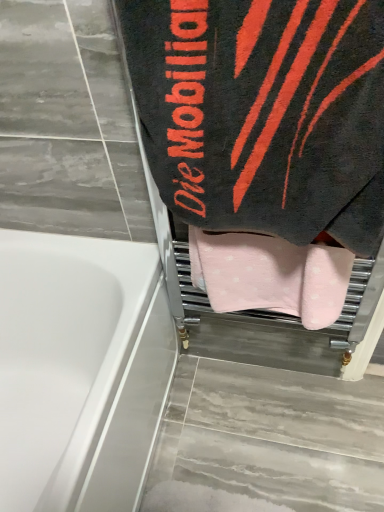
Identify the location of pink soft towel at center, arranged as the first towel when ordered from the bottom. (270, 275).

Is black terry cloth towel at upper right, arranged as the second towel when ordered from the bottom, to the left or to the right of pink soft towel at center, arranged as the first towel when ordered from the bottom, in the image?

From the image, it's evident that black terry cloth towel at upper right, arranged as the second towel when ordered from the bottom, is to the left of pink soft towel at center, arranged as the first towel when ordered from the bottom.

The width and height of the screenshot is (384, 512). In order to click on towel that appears below the black terry cloth towel at upper right, arranged as the second towel when ordered from the bottom (from a real-world perspective) in this screenshot , I will do `click(270, 275)`.

Is black terry cloth towel at upper right, positioned as the 1th towel in top-to-bottom order, situated inside pink soft towel at center, which appears as the second towel when viewed from the top, or outside?

black terry cloth towel at upper right, positioned as the 1th towel in top-to-bottom order, is outside pink soft towel at center, which appears as the second towel when viewed from the top.

From a real-world perspective, is black terry cloth towel at upper right, arranged as the second towel when ordered from the bottom, physically below pink soft towel at center, arranged as the first towel when ordered from the bottom?

Actually, black terry cloth towel at upper right, arranged as the second towel when ordered from the bottom, is physically above pink soft towel at center, arranged as the first towel when ordered from the bottom, in the real world.

From the image's perspective, is white glossy bathtub at lower left below pink soft towel at center, which appears as the second towel when viewed from the top?

Yes.

From a real-world perspective, is white glossy bathtub at lower left physically above pink soft towel at center, which appears as the second towel when viewed from the top?

No, from a real-world perspective, white glossy bathtub at lower left is not above pink soft towel at center, which appears as the second towel when viewed from the top.

Is white glossy bathtub at lower left spatially inside pink soft towel at center, which appears as the second towel when viewed from the top, or outside of it?

white glossy bathtub at lower left cannot be found inside pink soft towel at center, which appears as the second towel when viewed from the top.

Is white glossy bathtub at lower left positioned far away from pink soft towel at center, arranged as the first towel when ordered from the bottom?

No.

Is pink soft towel at center, which appears as the second towel when viewed from the top, spatially inside white glossy bathtub at lower left, or outside of it?

The correct answer is: outside.

Which is more distant, (206,278) or (162,372)?

The point (162,372) is farther from the camera.

Who is bigger, pink soft towel at center, arranged as the first towel when ordered from the bottom, or white glossy bathtub at lower left?

With larger size is white glossy bathtub at lower left.

Is white glossy bathtub at lower left facing away from black terry cloth towel at upper right, arranged as the second towel when ordered from the bottom?

No, white glossy bathtub at lower left is not facing the opposite direction of black terry cloth towel at upper right, arranged as the second towel when ordered from the bottom.

From the image's perspective, relative to black terry cloth towel at upper right, positioned as the 1th towel in top-to-bottom order, is white glossy bathtub at lower left above or below?

white glossy bathtub at lower left is below black terry cloth towel at upper right, positioned as the 1th towel in top-to-bottom order.

Is white glossy bathtub at lower left taller or shorter than black terry cloth towel at upper right, positioned as the 1th towel in top-to-bottom order?

Clearly, white glossy bathtub at lower left is taller compared to black terry cloth towel at upper right, positioned as the 1th towel in top-to-bottom order.

Looking at this image, looking at their sizes, would you say white glossy bathtub at lower left is wider or thinner than black terry cloth towel at upper right, positioned as the 1th towel in top-to-bottom order?

Clearly, white glossy bathtub at lower left has more width compared to black terry cloth towel at upper right, positioned as the 1th towel in top-to-bottom order.

Between black terry cloth towel at upper right, arranged as the second towel when ordered from the bottom, and white glossy bathtub at lower left, which one has larger size?

With larger size is white glossy bathtub at lower left.

From the picture: Is black terry cloth towel at upper right, arranged as the second towel when ordered from the bottom, next to white glossy bathtub at lower left?

No, black terry cloth towel at upper right, arranged as the second towel when ordered from the bottom, is not with white glossy bathtub at lower left.

From a real-world perspective, which is physically above, black terry cloth towel at upper right, arranged as the second towel when ordered from the bottom, or white glossy bathtub at lower left?

black terry cloth towel at upper right, arranged as the second towel when ordered from the bottom.

Could black terry cloth towel at upper right, arranged as the second towel when ordered from the bottom, be considered to be inside pink soft towel at center, which appears as the second towel when viewed from the top?

No.

Could you tell me if pink soft towel at center, arranged as the first towel when ordered from the bottom, is turned towards black terry cloth towel at upper right, positioned as the 1th towel in top-to-bottom order?

No, pink soft towel at center, arranged as the first towel when ordered from the bottom, is not facing towards black terry cloth towel at upper right, positioned as the 1th towel in top-to-bottom order.

Identify the location of towel below the black terry cloth towel at upper right, arranged as the second towel when ordered from the bottom (from the image's perspective). (270, 275).

Is pink soft towel at center, arranged as the first towel when ordered from the bottom, not near black terry cloth towel at upper right, positioned as the 1th towel in top-to-bottom order?

Actually, pink soft towel at center, arranged as the first towel when ordered from the bottom, and black terry cloth towel at upper right, positioned as the 1th towel in top-to-bottom order, are a little close together.

Where is `towel on the right of black terry cloth towel at upper right, arranged as the second towel when ordered from the bottom`? This screenshot has width=384, height=512. towel on the right of black terry cloth towel at upper right, arranged as the second towel when ordered from the bottom is located at coordinates coord(270,275).

You are a GUI agent. You are given a task and a screenshot of the screen. Output one action in this format:
    pyautogui.click(x=<x>, y=<y>)
    Task: Click on the bathtub below the pink soft towel at center, arranged as the first towel when ordered from the bottom (from a real-world perspective)
    
    Given the screenshot: What is the action you would take?
    pyautogui.click(x=80, y=370)

Considering their positions, is white glossy bathtub at lower left positioned further to pink soft towel at center, arranged as the first towel when ordered from the bottom, than black terry cloth towel at upper right, positioned as the 1th towel in top-to-bottom order?

white glossy bathtub at lower left is further to pink soft towel at center, arranged as the first towel when ordered from the bottom.

Which object lies nearer to the anchor point white glossy bathtub at lower left, black terry cloth towel at upper right, positioned as the 1th towel in top-to-bottom order, or pink soft towel at center, arranged as the first towel when ordered from the bottom?

pink soft towel at center, arranged as the first towel when ordered from the bottom, lies closer to white glossy bathtub at lower left than the other object.

Estimate the real-world distances between objects in this image. Which object is further from black terry cloth towel at upper right, positioned as the 1th towel in top-to-bottom order, pink soft towel at center, arranged as the first towel when ordered from the bottom, or white glossy bathtub at lower left?

Among the two, white glossy bathtub at lower left is located further to black terry cloth towel at upper right, positioned as the 1th towel in top-to-bottom order.

Estimate the real-world distances between objects in this image. Which object is further from pink soft towel at center, which appears as the second towel when viewed from the top, black terry cloth towel at upper right, positioned as the 1th towel in top-to-bottom order, or white glossy bathtub at lower left?

The object further to pink soft towel at center, which appears as the second towel when viewed from the top, is white glossy bathtub at lower left.

Looking at the image, which one is located closer to black terry cloth towel at upper right, positioned as the 1th towel in top-to-bottom order, white glossy bathtub at lower left or pink soft towel at center, which appears as the second towel when viewed from the top?

pink soft towel at center, which appears as the second towel when viewed from the top.

When comparing their distances from white glossy bathtub at lower left, does pink soft towel at center, which appears as the second towel when viewed from the top, or black terry cloth towel at upper right, positioned as the 1th towel in top-to-bottom order, seem closer?

pink soft towel at center, which appears as the second towel when viewed from the top, is closer to white glossy bathtub at lower left.

The width and height of the screenshot is (384, 512). Identify the location of towel situated between white glossy bathtub at lower left and pink soft towel at center, arranged as the first towel when ordered from the bottom, from left to right. (264, 113).